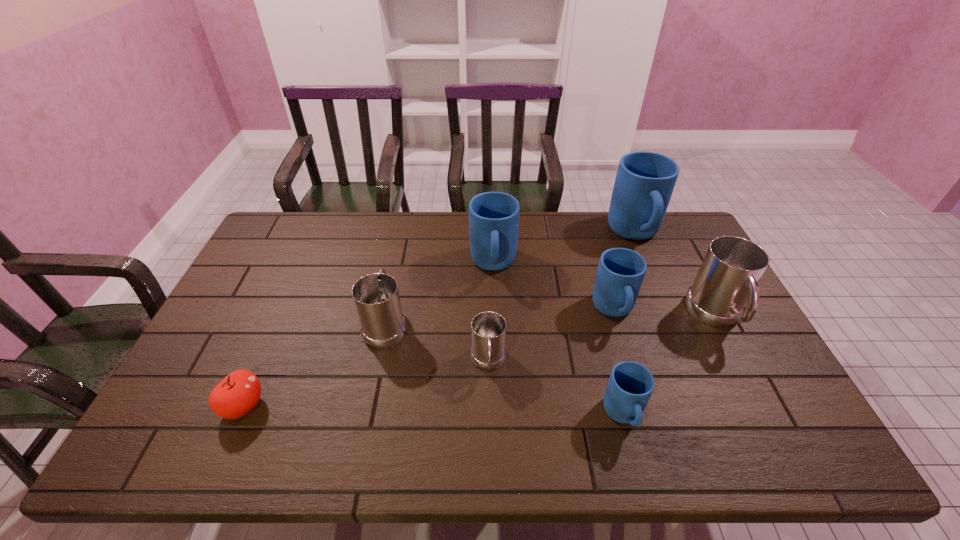
This screenshot has width=960, height=540. I want to click on apple, so click(237, 394).

Where is `red apple`? red apple is located at coordinates (237, 394).

Locate an element on the screen. This screenshot has height=540, width=960. vacant space situated on the side of the biggest blue mug with the handle is located at coordinates point(684,351).

Image resolution: width=960 pixels, height=540 pixels. I want to click on vacant space located on the side of the biggest gray mug with the handle, so coord(779,436).

Locate an element on the screen. free space located on the side of the leftmost blue mug with the handle is located at coordinates (495, 333).

This screenshot has width=960, height=540. I want to click on vacant region located 0.070m on the side of the leftmost mug with the handle, so click(x=394, y=286).

The height and width of the screenshot is (540, 960). In order to click on free space located on the side of the leftmost mug with the handle in this screenshot , I will do `click(398, 261)`.

Where is `vacant space located 0.150m on the side of the leftmost mug with the handle`? Image resolution: width=960 pixels, height=540 pixels. vacant space located 0.150m on the side of the leftmost mug with the handle is located at coordinates (397, 269).

Where is `vacant space located 0.300m on the side of the second smallest blue mug with the handle`? The image size is (960, 540). vacant space located 0.300m on the side of the second smallest blue mug with the handle is located at coordinates (651, 434).

Locate an element on the screen. This screenshot has height=540, width=960. vacant space located on the side of the second gray mug from right to left with the handle is located at coordinates (490, 457).